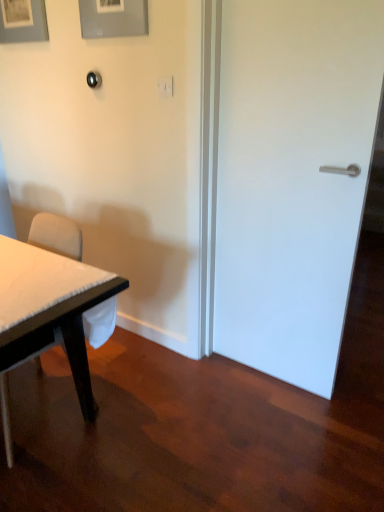
Where is `vacant area that lies between white matte door at right and white fabric chair at left`? The width and height of the screenshot is (384, 512). vacant area that lies between white matte door at right and white fabric chair at left is located at coordinates (169, 402).